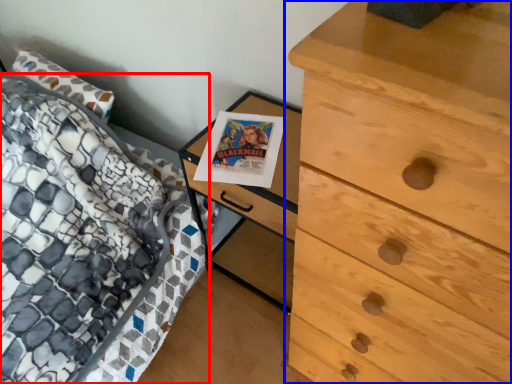
Question: Which object appears closest to the camera in this image, bed (highlighted by a red box) or chest of drawers (highlighted by a blue box)?

Choices:
 (A) bed
 (B) chest of drawers

Answer: (B)